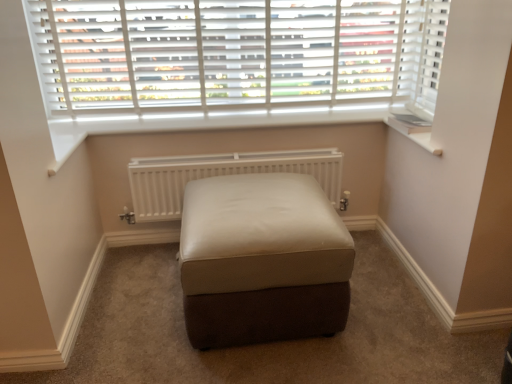
Image resolution: width=512 pixels, height=384 pixels. Find the location of `vacant space positioned to the left of leather ottoman at center`. vacant space positioned to the left of leather ottoman at center is located at coordinates (136, 309).